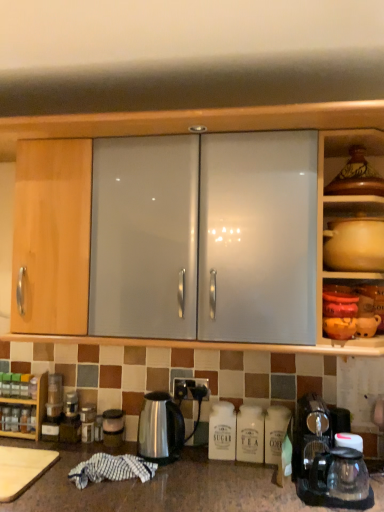
Question: Considering the relative sizes of wooden spice rack at lower left, the second cabinetry positioned from the front, and satin silver canister at lower center, placed as the second appliance when sorted from left to right, in the image provided, is wooden spice rack at lower left, the second cabinetry positioned from the front, smaller than satin silver canister at lower center, placed as the second appliance when sorted from left to right,?

Choices:
 (A) yes
 (B) no

Answer: (B)

Question: Is wooden spice rack at lower left, marked as the first cabinetry in a left-to-right arrangement, closer to the viewer compared to satin silver canister at lower center, placed as the second appliance when sorted from left to right?

Choices:
 (A) yes
 (B) no

Answer: (B)

Question: Is wooden spice rack at lower left, which ranks as the second cabinetry in right-to-left order, positioned beyond the bounds of satin silver canister at lower center, placed as the second appliance when sorted from left to right?

Choices:
 (A) yes
 (B) no

Answer: (A)

Question: From the image's perspective, is wooden spice rack at lower left, the second cabinetry positioned from the front, above satin silver canister at lower center, placed as the second appliance when sorted from left to right?

Choices:
 (A) yes
 (B) no

Answer: (A)

Question: Considering the relative positions of wooden spice rack at lower left, the 2th cabinetry from the top, and satin silver canister at lower center, placed as the first appliance when sorted from right to left, in the image provided, is wooden spice rack at lower left, the 2th cabinetry from the top, behind satin silver canister at lower center, placed as the first appliance when sorted from right to left,?

Choices:
 (A) yes
 (B) no

Answer: (A)

Question: From the image's perspective, relative to matte brown pot at upper right, is matte ceramic pot at upper right, the 1th cabinetry from the right, above or below?

Choices:
 (A) below
 (B) above

Answer: (B)

Question: Is matte ceramic pot at upper right, which is the 2th cabinetry in back-to-front order, in front of or behind matte brown pot at upper right in the image?

Choices:
 (A) behind
 (B) front

Answer: (B)

Question: Considering the positions of matte ceramic pot at upper right, which is the 2th cabinetry in back-to-front order, and matte brown pot at upper right in the image, is matte ceramic pot at upper right, which is the 2th cabinetry in back-to-front order, taller or shorter than matte brown pot at upper right?

Choices:
 (A) tall
 (B) short

Answer: (A)

Question: From a real-world perspective, is matte ceramic pot at upper right, the 1th cabinetry from the front, above or below matte brown pot at upper right?

Choices:
 (A) above
 (B) below

Answer: (A)

Question: Considering the positions of matte brown pot at upper right and transparent glass coffee machine at lower right in the image, is matte brown pot at upper right bigger or smaller than transparent glass coffee machine at lower right?

Choices:
 (A) small
 (B) big

Answer: (A)

Question: Visually, is matte brown pot at upper right positioned to the left or to the right of transparent glass coffee machine at lower right?

Choices:
 (A) right
 (B) left

Answer: (A)

Question: Which is correct: matte brown pot at upper right is inside transparent glass coffee machine at lower right, or outside of it?

Choices:
 (A) inside
 (B) outside

Answer: (B)

Question: From the image's perspective, is matte brown pot at upper right above or below transparent glass coffee machine at lower right?

Choices:
 (A) above
 (B) below

Answer: (A)

Question: Considering the relative positions of satin silver canister at lower center, placed as the second appliance when sorted from left to right, and brown matte vase at upper right in the image provided, is satin silver canister at lower center, placed as the second appliance when sorted from left to right, to the left or to the right of brown matte vase at upper right?

Choices:
 (A) right
 (B) left

Answer: (B)

Question: In the image, is satin silver canister at lower center, placed as the first appliance when sorted from right to left, positioned in front of or behind brown matte vase at upper right?

Choices:
 (A) behind
 (B) front

Answer: (A)